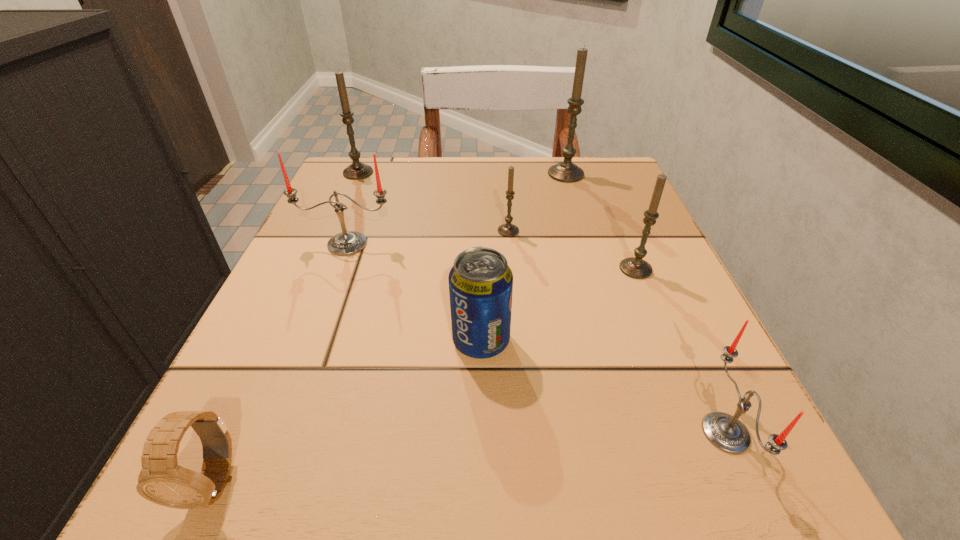
Identify the location of the tallest object. (566, 171).

At what (x,y) coordinates should I click in order to perform the action: click on the third gray candle from left to right. Please return your answer as a coordinate pair (x, y). This screenshot has height=540, width=960. Looking at the image, I should click on (566, 171).

Where is `the third smallest gray candle`? This screenshot has height=540, width=960. the third smallest gray candle is located at coordinates (357, 170).

Find the location of a particular element. the leftmost gray candle is located at coordinates (357, 170).

This screenshot has width=960, height=540. I want to click on the left red candle, so click(x=346, y=243).

Identify the location of the bigger red candle. This screenshot has height=540, width=960. (346, 243).

Locate an element on the screen. the nearest gray candle is located at coordinates (635, 267).

Identify the location of the fourth nearest object. The height and width of the screenshot is (540, 960). (635, 267).

At what (x,y) coordinates should I click in order to perform the action: click on the third nearest object. Please return your answer as a coordinate pair (x, y). Image resolution: width=960 pixels, height=540 pixels. Looking at the image, I should click on (480, 283).

In order to click on the second gray candle from left to right in this screenshot , I will do `click(508, 230)`.